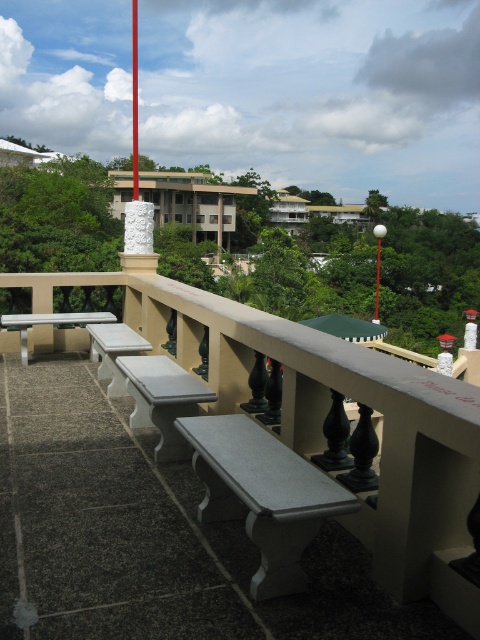
Does gray stone bench at center appear on the left side of white glossy picnic table at left?

Incorrect, gray stone bench at center is not on the left side of white glossy picnic table at left.

Who is taller, gray stone bench at center or white glossy picnic table at left?

With more height is gray stone bench at center.

Image resolution: width=480 pixels, height=640 pixels. Identify the location of gray stone bench at center. (263, 493).

Between point (181, 454) and point (31, 321), which one is positioned behind?

Point (31, 321)

Where is `smooth gray bench at center`? Image resolution: width=480 pixels, height=640 pixels. smooth gray bench at center is located at coordinates (163, 400).

Does gray stone bench at center lie behind white marble bench at lower left?

No, gray stone bench at center is closer to the viewer.

Is point (311, 474) closer to camera compared to point (96, 340)?

Yes.

Identify the location of gray stone bench at center. The width and height of the screenshot is (480, 640). (263, 493).